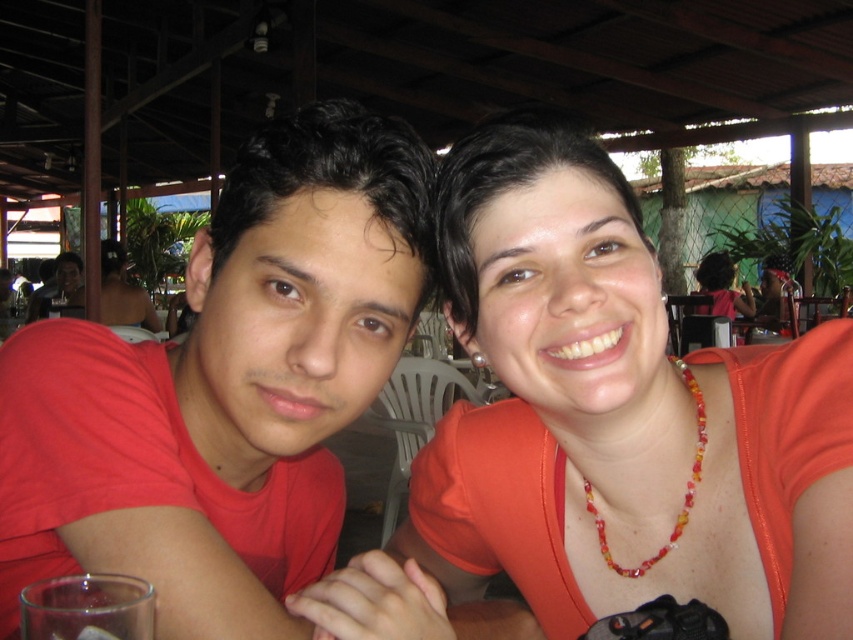
Question: Which point is farther to the camera?

Choices:
 (A) matte orange shirt at upper right
 (B) matte black laptop at left

Answer: (B)

Question: Is matte orange shirt at upper right to the right of matte black laptop at left from the viewer's perspective?

Choices:
 (A) yes
 (B) no

Answer: (A)

Question: Which point appears farthest from the camera in this image?

Choices:
 (A) (729, 266)
 (B) (697, 397)
 (C) (62, 280)

Answer: (C)

Question: Is multicolored beaded necklace at upper right further to camera compared to matte black laptop at left?

Choices:
 (A) no
 (B) yes

Answer: (A)

Question: Does multicolored beaded necklace at upper right have a lesser width compared to matte orange shirt at upper right?

Choices:
 (A) no
 (B) yes

Answer: (B)

Question: Estimate the real-world distances between objects in this image. Which object is closer to the matte orange shirt at upper right?

Choices:
 (A) matte black laptop at left
 (B) multicolored beaded necklace at upper right

Answer: (A)